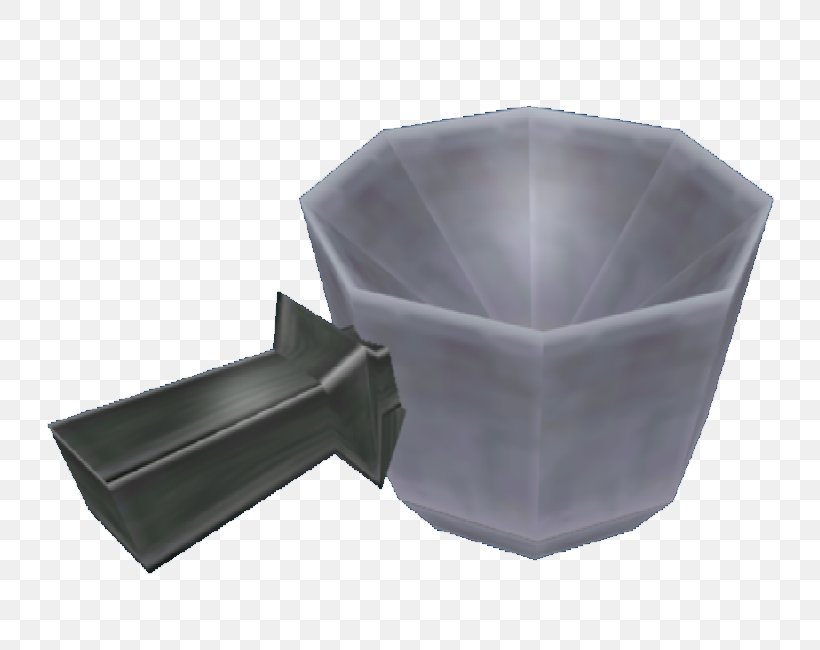
The image size is (820, 650). I want to click on handle, so click(x=231, y=419).